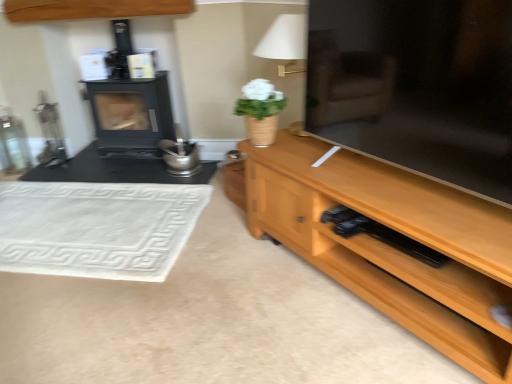
Question: Does white fabric lampshade at upper center have a smaller size compared to wooden cabinet at upper center?

Choices:
 (A) yes
 (B) no

Answer: (B)

Question: Is wooden cabinet at upper center at the back of white fabric lampshade at upper center?

Choices:
 (A) yes
 (B) no

Answer: (B)

Question: Does white fabric lampshade at upper center have a lesser width compared to wooden cabinet at upper center?

Choices:
 (A) yes
 (B) no

Answer: (B)

Question: Is white fabric lampshade at upper center to the right of wooden cabinet at upper center from the viewer's perspective?

Choices:
 (A) no
 (B) yes

Answer: (B)

Question: Is white fabric lampshade at upper center facing towards wooden cabinet at upper center?

Choices:
 (A) yes
 (B) no

Answer: (B)

Question: Is white woven mat at lower left bigger or smaller than wooden tv stand at right?

Choices:
 (A) big
 (B) small

Answer: (B)

Question: Does point tap(124, 236) appear closer or farther from the camera than point tap(339, 271)?

Choices:
 (A) farther
 (B) closer

Answer: (A)

Question: From the image's perspective, is white woven mat at lower left located above or below wooden tv stand at right?

Choices:
 (A) below
 (B) above

Answer: (B)

Question: From their relative heights in the image, would you say white woven mat at lower left is taller or shorter than wooden tv stand at right?

Choices:
 (A) short
 (B) tall

Answer: (A)

Question: Does point (257, 79) appear closer or farther from the camera than point (399, 256)?

Choices:
 (A) closer
 (B) farther

Answer: (B)

Question: Is white matte vase at center situated inside wooden tv stand at right or outside?

Choices:
 (A) outside
 (B) inside

Answer: (A)

Question: In the image, is white matte vase at center on the left side or the right side of wooden tv stand at right?

Choices:
 (A) right
 (B) left

Answer: (A)

Question: From the image's perspective, relative to wooden tv stand at right, is white matte vase at center above or below?

Choices:
 (A) above
 (B) below

Answer: (A)

Question: Considering the positions of wooden cabinet at upper center and white matte vase at center in the image, is wooden cabinet at upper center bigger or smaller than white matte vase at center?

Choices:
 (A) small
 (B) big

Answer: (B)

Question: From the image's perspective, is wooden cabinet at upper center positioned above or below white matte vase at center?

Choices:
 (A) above
 (B) below

Answer: (A)